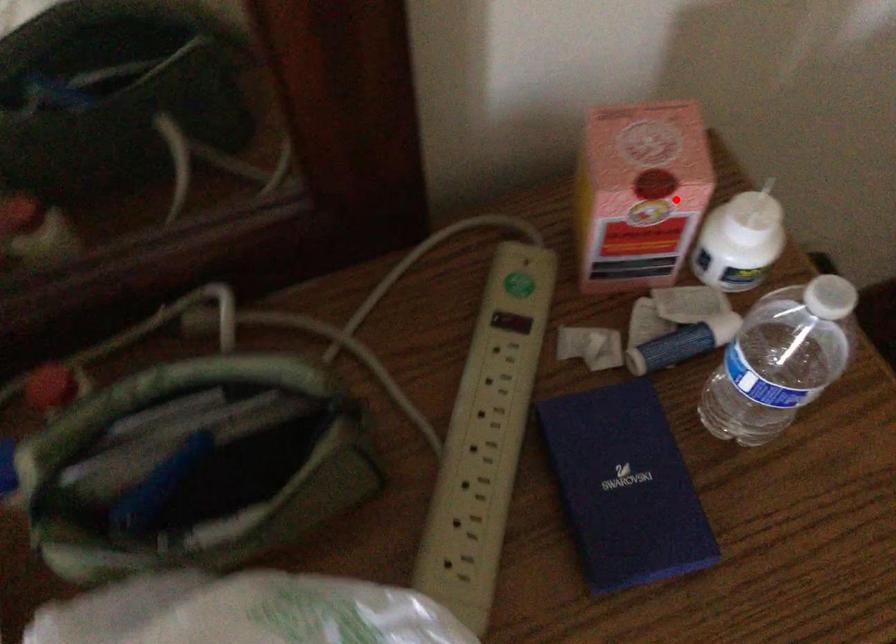
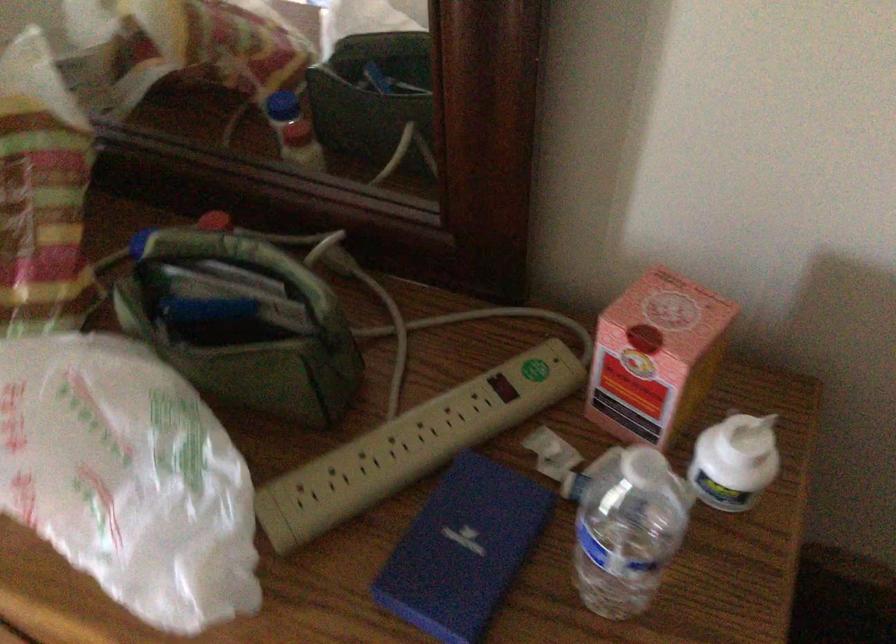
The point at the highlighted location is marked in the first image. Where is the corresponding point in the second image?

(656, 357)